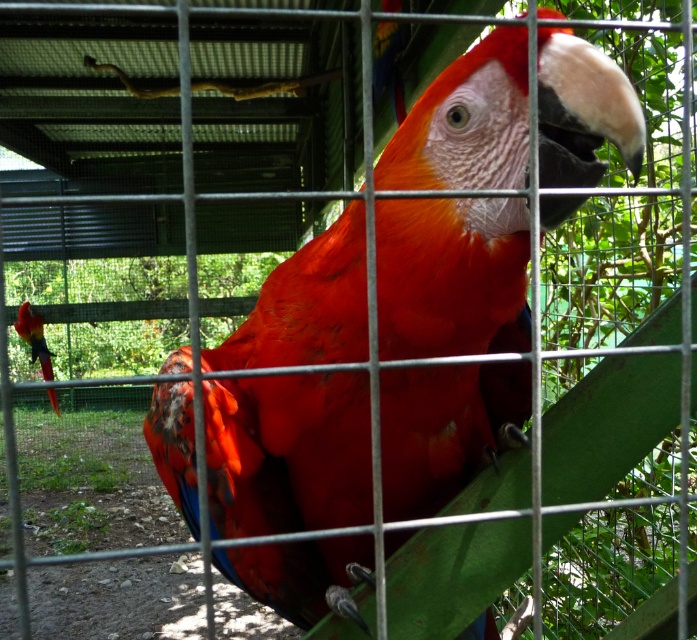
Does glossy feathers parrot at center have a lesser width compared to shiny red parrot at left?

Correct, glossy feathers parrot at center's width is less than shiny red parrot at left's.

Who is more forward, (x=436, y=170) or (x=43, y=340)?

Positioned in front is point (x=436, y=170).

Between point (487, 234) and point (40, 358), which one is positioned in front?

Point (487, 234) is more forward.

Where is `glossy feathers parrot at center`? The height and width of the screenshot is (640, 697). glossy feathers parrot at center is located at coordinates (286, 452).